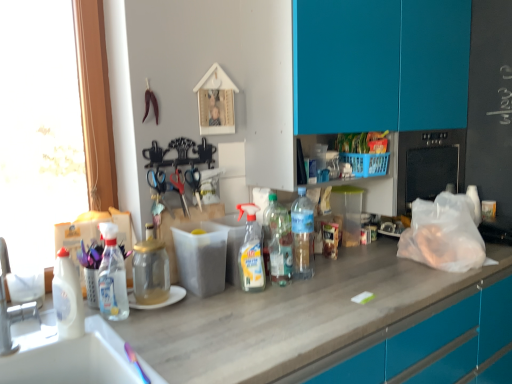
The image size is (512, 384). Describe the element at coordinates (278, 240) in the screenshot. I see `translucent plastic bottles at center, which appears as the fifth bottle when viewed from the left` at that location.

What do you see at coordinates (11, 307) in the screenshot?
I see `brushed metal faucet at lower left` at bounding box center [11, 307].

Measure the distance between point (109, 272) and camera.

The depth of point (109, 272) is 4.34 feet.

This screenshot has height=384, width=512. What do you see at coordinates (179, 190) in the screenshot?
I see `red plastic scissors at center, the second scissors positioned from the right` at bounding box center [179, 190].

At what (x,y) coordinates should I click in order to perform the action: click on black plastic scissors at center, which is counted as the 1th scissors, starting from the right. Please return your answer as a coordinate pair (x, y). The image size is (512, 384). Looking at the image, I should click on (194, 182).

How many degrees apart are the facing directions of red plastic scissors at center, arranged as the 2th scissors when viewed from the left, and clear plastic bottle at center, placed as the 1th bottle when sorted from right to left?

There is a 7.08-degree angle between the facing directions of red plastic scissors at center, arranged as the 2th scissors when viewed from the left, and clear plastic bottle at center, placed as the 1th bottle when sorted from right to left.

Can you confirm if red plastic scissors at center, the second scissors positioned from the right, is positioned to the left of clear plastic bottle at center, which is the sixth bottle in left-to-right order?

Correct, you'll find red plastic scissors at center, the second scissors positioned from the right, to the left of clear plastic bottle at center, which is the sixth bottle in left-to-right order.

Looking at this image, which is correct: red plastic scissors at center, arranged as the 2th scissors when viewed from the left, is inside clear plastic bottle at center, placed as the 1th bottle when sorted from right to left, or outside of it?

red plastic scissors at center, arranged as the 2th scissors when viewed from the left, is not enclosed by clear plastic bottle at center, placed as the 1th bottle when sorted from right to left.

Considering the relative sizes of black plastic scissors at center, which is counted as the 1th scissors, starting from the right, and white glossy bottle at left, the first bottle from the left, in the image provided, is black plastic scissors at center, which is counted as the 1th scissors, starting from the right, smaller than white glossy bottle at left, the first bottle from the left,?

Indeed, black plastic scissors at center, which is counted as the 1th scissors, starting from the right, has a smaller size compared to white glossy bottle at left, the first bottle from the left.

Considering the sizes of black plastic scissors at center, which is counted as the 1th scissors, starting from the right, and white glossy bottle at left, the first bottle from the left, in the image, is black plastic scissors at center, which is counted as the 1th scissors, starting from the right, taller or shorter than white glossy bottle at left, the first bottle from the left,?

Considering their sizes, black plastic scissors at center, which is counted as the 1th scissors, starting from the right, has less height than white glossy bottle at left, the first bottle from the left.

Is black plastic scissors at center, the 3th scissors positioned from the left, to the left of white glossy bottle at left, which is the sixth bottle from right to left, from the viewer's perspective?

No.

Where is `the 3rd scissors to the right when counting from the white glossy bottle at left, which is the sixth bottle from right to left`? the 3rd scissors to the right when counting from the white glossy bottle at left, which is the sixth bottle from right to left is located at coordinates (194, 182).

Does translucent plastic spray bottle at center, placed as the 4th bottle when sorted from left to right, have a lesser width compared to transparent plastic spray bottle at left, positioned as the second bottle in left-to-right order?

Correct, the width of translucent plastic spray bottle at center, placed as the 4th bottle when sorted from left to right, is less than that of transparent plastic spray bottle at left, positioned as the second bottle in left-to-right order.

Could you tell me if translucent plastic spray bottle at center, the third bottle viewed from the right, is turned towards transparent plastic spray bottle at left, arranged as the 5th bottle when viewed from the right?

No, translucent plastic spray bottle at center, the third bottle viewed from the right, is not oriented towards transparent plastic spray bottle at left, arranged as the 5th bottle when viewed from the right.

Considering the relative positions of translucent plastic spray bottle at center, the third bottle viewed from the right, and transparent plastic spray bottle at left, positioned as the second bottle in left-to-right order, in the image provided, is translucent plastic spray bottle at center, the third bottle viewed from the right, behind transparent plastic spray bottle at left, positioned as the second bottle in left-to-right order,?

Yes.

Between translucent plastic spray bottle at center, placed as the 4th bottle when sorted from left to right, and transparent plastic spray bottle at left, positioned as the second bottle in left-to-right order, which one has smaller size?

translucent plastic spray bottle at center, placed as the 4th bottle when sorted from left to right, is smaller.

Does brushed metal faucet at lower left lie in front of white glossy bottle at left, the first bottle from the left?

Yes, brushed metal faucet at lower left is in front of white glossy bottle at left, the first bottle from the left.

From the image's perspective, is brushed metal faucet at lower left positioned above or below white glossy bottle at left, which is the sixth bottle from right to left?

From the image's perspective, brushed metal faucet at lower left appears above white glossy bottle at left, which is the sixth bottle from right to left.

Is brushed metal faucet at lower left wider or thinner than white glossy bottle at left, the first bottle from the left?

Considering their sizes, brushed metal faucet at lower left looks broader than white glossy bottle at left, the first bottle from the left.

Does transparent glass jar at center, the 4th bottle viewed from the right, have a greater width compared to black plastic scissors at center, which is counted as the 1th scissors, starting from the right?

Correct, the width of transparent glass jar at center, the 4th bottle viewed from the right, exceeds that of black plastic scissors at center, which is counted as the 1th scissors, starting from the right.

Is transparent glass jar at center, acting as the 3th bottle starting from the left, far away from black plastic scissors at center, which is counted as the 1th scissors, starting from the right?

No, there isn't a large distance between transparent glass jar at center, acting as the 3th bottle starting from the left, and black plastic scissors at center, which is counted as the 1th scissors, starting from the right.

From a real-world perspective, starting from the transparent glass jar at center, the 4th bottle viewed from the right, which scissors is the 3rd one vertically above it? Please provide its 2D coordinates.

[(194, 182)]

From a real-world perspective, is transparent glass jar at center, the 4th bottle viewed from the right, over black plastic scissors at center, the 3th scissors positioned from the left?

No, from a real-world perspective, transparent glass jar at center, the 4th bottle viewed from the right, is not above black plastic scissors at center, the 3th scissors positioned from the left.

Considering their positions, is clear plastic bottle at center, placed as the 1th bottle when sorted from right to left, located in front of or behind translucent plastic bottles at center, the 2th bottle viewed from the right?

Clearly, clear plastic bottle at center, placed as the 1th bottle when sorted from right to left, is behind translucent plastic bottles at center, the 2th bottle viewed from the right.

Is translucent plastic bottles at center, the 2th bottle viewed from the right, located within clear plastic bottle at center, placed as the 1th bottle when sorted from right to left?

That's incorrect, translucent plastic bottles at center, the 2th bottle viewed from the right, is not inside clear plastic bottle at center, placed as the 1th bottle when sorted from right to left.

From the picture: Is clear plastic bottle at center, which is the sixth bottle in left-to-right order, facing away from translucent plastic bottles at center, the 2th bottle viewed from the right?

No.

Which of these two, clear plastic bottle at center, which is the sixth bottle in left-to-right order, or translucent plastic bottles at center, which appears as the fifth bottle when viewed from the left, stands shorter?

Standing shorter between the two is translucent plastic bottles at center, which appears as the fifth bottle when viewed from the left.

Between point (305, 221) and point (251, 221), which one is positioned in front?

The point (251, 221) is more forward.

Can you confirm if clear plastic bottle at center, which is the sixth bottle in left-to-right order, is shorter than translucent plastic spray bottle at center, the third bottle viewed from the right?

Yes, clear plastic bottle at center, which is the sixth bottle in left-to-right order, is shorter than translucent plastic spray bottle at center, the third bottle viewed from the right.

How many degrees apart are the facing directions of clear plastic bottle at center, placed as the 1th bottle when sorted from right to left, and translucent plastic spray bottle at center, the third bottle viewed from the right?

clear plastic bottle at center, placed as the 1th bottle when sorted from right to left, and translucent plastic spray bottle at center, the third bottle viewed from the right, are facing 18.3 degrees away from each other.

Looking at this image, from a real-world perspective, between clear plastic bottle at center, which is the sixth bottle in left-to-right order, and translucent plastic spray bottle at center, placed as the 4th bottle when sorted from left to right, who is vertically higher?

clear plastic bottle at center, which is the sixth bottle in left-to-right order, is physically above.

Identify the location of the 2nd scissors to the left of the clear plastic bottle at center, placed as the 1th bottle when sorted from right to left, starting your count from the anchor. (179, 190).

Which scissors is the 3rd one when counting from the right side of the white glossy bottle at left, which is the sixth bottle from right to left? Please provide its 2D coordinates.

[(194, 182)]

From the image, which object appears to be nearer to black plastic scissors at center, the 3th scissors positioned from the left, white glossy bottle at left, which is the sixth bottle from right to left, or clear plastic bottle at center, which is the sixth bottle in left-to-right order?

clear plastic bottle at center, which is the sixth bottle in left-to-right order, is closer to black plastic scissors at center, the 3th scissors positioned from the left.

When comparing their distances from metallic sheen scissors at center, acting as the 1th scissors starting from the left, does clear plastic bottle at center, placed as the 1th bottle when sorted from right to left, or black plastic scissors at center, the 3th scissors positioned from the left, seem closer?

black plastic scissors at center, the 3th scissors positioned from the left, lies closer to metallic sheen scissors at center, acting as the 1th scissors starting from the left, than the other object.

Which object lies nearer to the anchor point translucent plastic spray bottle at center, the third bottle viewed from the right, white glossy bottle at left, the first bottle from the left, or transparent plastic spray bottle at left, positioned as the second bottle in left-to-right order?

transparent plastic spray bottle at left, positioned as the second bottle in left-to-right order, is positioned closer to the anchor translucent plastic spray bottle at center, the third bottle viewed from the right.

From the image, which object appears to be farther from transparent glass jar at center, the 4th bottle viewed from the right, brushed metal faucet at lower left or translucent plastic bottles at center, the 2th bottle viewed from the right?

Based on the image, translucent plastic bottles at center, the 2th bottle viewed from the right, appears to be further to transparent glass jar at center, the 4th bottle viewed from the right.

Based on their spatial positions, is black plastic scissors at center, which is counted as the 1th scissors, starting from the right, or white glossy bottle at left, the first bottle from the left, further from translucent plastic bottles at center, the 2th bottle viewed from the right?

white glossy bottle at left, the first bottle from the left, is further to translucent plastic bottles at center, the 2th bottle viewed from the right.

Based on their spatial positions, is white glossy bottle at left, which is the sixth bottle from right to left, or translucent plastic spray bottle at center, placed as the 4th bottle when sorted from left to right, further from transparent glass jar at center, acting as the 3th bottle starting from the left?

Based on the image, translucent plastic spray bottle at center, placed as the 4th bottle when sorted from left to right, appears to be further to transparent glass jar at center, acting as the 3th bottle starting from the left.

Which object lies further to the anchor point metallic sheen scissors at center, which appears as the third scissors when viewed from the right, translucent plastic spray bottle at center, placed as the 4th bottle when sorted from left to right, or white glossy bottle at left, which is the sixth bottle from right to left?

white glossy bottle at left, which is the sixth bottle from right to left, is further to metallic sheen scissors at center, which appears as the third scissors when viewed from the right.

When comparing their distances from white glossy bottle at left, the first bottle from the left, does transparent plastic spray bottle at left, arranged as the 5th bottle when viewed from the right, or red plastic scissors at center, the second scissors positioned from the right, seem further?

The object further to white glossy bottle at left, the first bottle from the left, is red plastic scissors at center, the second scissors positioned from the right.

This screenshot has width=512, height=384. Find the location of `scissors located between transparent plastic spray bottle at left, positioned as the second bottle in left-to-right order, and red plastic scissors at center, arranged as the 2th scissors when viewed from the left, in the depth direction`. scissors located between transparent plastic spray bottle at left, positioned as the second bottle in left-to-right order, and red plastic scissors at center, arranged as the 2th scissors when viewed from the left, in the depth direction is located at coordinates point(159,191).

Find the location of a particular element. This screenshot has width=512, height=384. scissors situated between red plastic scissors at center, arranged as the 2th scissors when viewed from the left, and clear plastic bottle at center, which is the sixth bottle in left-to-right order, from left to right is located at coordinates (194, 182).

You are a GUI agent. You are given a task and a screenshot of the screen. Output one action in this format:
    pyautogui.click(x=<x>, y=<y>)
    Task: Click on the scissors between red plastic scissors at center, the second scissors positioned from the right, and transparent glass jar at center, the 4th bottle viewed from the right, vertically
    The width and height of the screenshot is (512, 384).
    Given the screenshot: What is the action you would take?
    pyautogui.click(x=159, y=191)

You are a GUI agent. You are given a task and a screenshot of the screen. Output one action in this format:
    pyautogui.click(x=<x>, y=<y>)
    Task: Click on the bottle between white glossy bottle at left, the first bottle from the left, and transparent glass jar at center, acting as the 3th bottle starting from the left, from front to back
    The height and width of the screenshot is (384, 512).
    Given the screenshot: What is the action you would take?
    pyautogui.click(x=112, y=277)